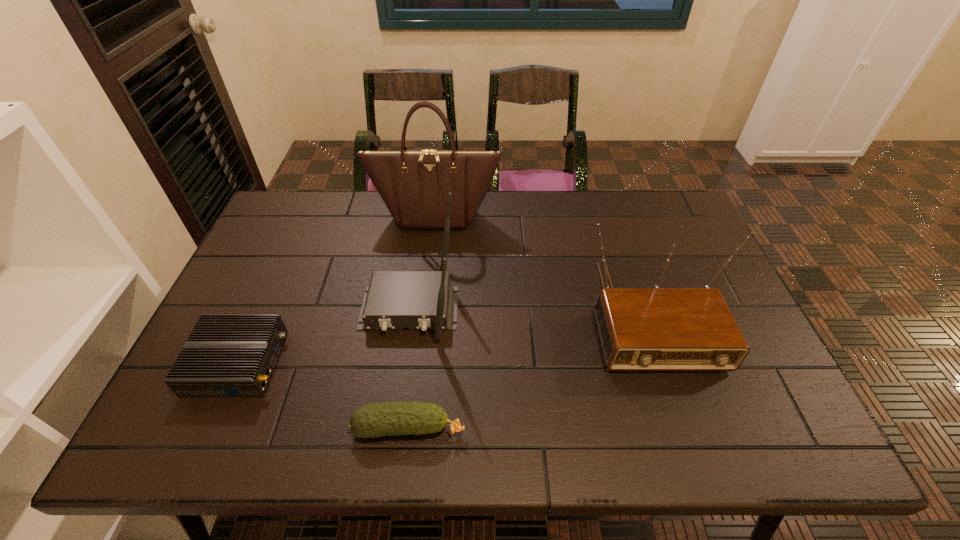
Where is `vacant space at the far left corner of the desktop`? Image resolution: width=960 pixels, height=540 pixels. vacant space at the far left corner of the desktop is located at coordinates (315, 226).

At what (x,y) coordinates should I click in order to perform the action: click on vacant point at the far right corner. Please return your answer as a coordinate pair (x, y). The image size is (960, 540). Looking at the image, I should click on (676, 198).

This screenshot has height=540, width=960. I want to click on empty location between the rightmost object and the nearest object, so click(x=527, y=370).

You are a GUI agent. You are given a task and a screenshot of the screen. Output one action in this format:
    pyautogui.click(x=<x>, y=<y>)
    Task: Click on the free space between the taller router and the rightmost object
    The height and width of the screenshot is (540, 960).
    Given the screenshot: What is the action you would take?
    pyautogui.click(x=528, y=310)

Find the location of a particular element. This screenshot has width=960, height=540. unoccupied position between the right router and the left router is located at coordinates (324, 335).

The image size is (960, 540). In order to click on free space between the farthest object and the rightmost object in this screenshot , I will do `click(540, 265)`.

In order to click on vacant space that's between the taller router and the cucumber in this screenshot , I will do `click(409, 368)`.

Locate an element on the screen. This screenshot has height=540, width=960. vacant point located between the right router and the radio_receiver is located at coordinates (528, 310).

Find the location of a particular element. This screenshot has height=540, width=960. free space that is in between the rightmost object and the right router is located at coordinates (528, 310).

The width and height of the screenshot is (960, 540). In order to click on empty space between the nearest object and the radio_receiver in this screenshot , I will do `click(527, 370)`.